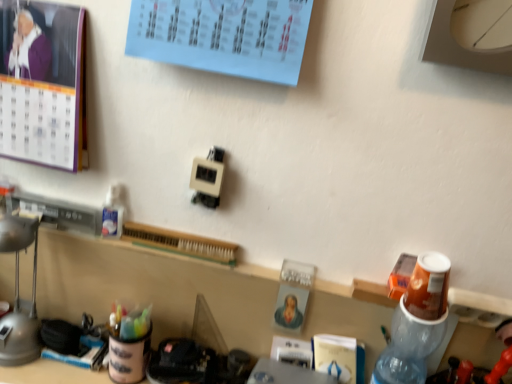
Where is `purple paper calendar at upper left`? Image resolution: width=512 pixels, height=384 pixels. purple paper calendar at upper left is located at coordinates 42,84.

Locate an element on the screen. purple paper calendar at upper left is located at coordinates (42, 84).

Between purple paper calendar at upper left and matte gray lamp at left, which one has less height?

Standing shorter between the two is purple paper calendar at upper left.

In the scene shown: Is purple paper calendar at upper left facing towards matte gray lamp at left?

No, purple paper calendar at upper left is not aimed at matte gray lamp at left.

From a real-world perspective, is purple paper calendar at upper left physically below matte gray lamp at left?

No.

How much distance is there between purple paper calendar at upper left and matte gray lamp at left?

purple paper calendar at upper left is 9.88 inches away from matte gray lamp at left.

From the image's perspective, which object appears higher, matte gray lamp at left or translucent plastic bottle at right?

From the image's view, matte gray lamp at left is above.

Would you say matte gray lamp at left is inside or outside translucent plastic bottle at right?

matte gray lamp at left cannot be found inside translucent plastic bottle at right.

Is matte gray lamp at left facing towards translucent plastic bottle at right?

No, matte gray lamp at left is not facing towards translucent plastic bottle at right.

The height and width of the screenshot is (384, 512). Identify the location of bulletin board positioned vertically above the matte gray lamp at left (from a real-world perspective). (42, 84).

In terms of width, does matte gray lamp at left look wider or thinner when compared to purple paper calendar at upper left?

matte gray lamp at left is wider than purple paper calendar at upper left.

From the image's perspective, is matte gray lamp at left over purple paper calendar at upper left?

No, from the image's perspective, matte gray lamp at left is not on top of purple paper calendar at upper left.

Would you say matte gray lamp at left is a long distance from purple paper calendar at upper left?

No, matte gray lamp at left is not far away from purple paper calendar at upper left.

From the image's perspective, between translucent plastic bottle at right and matte gray lamp at left, who is located below?

translucent plastic bottle at right, from the image's perspective.

Measure the distance from translucent plastic bottle at right to matte gray lamp at left.

translucent plastic bottle at right and matte gray lamp at left are 27.09 inches apart from each other.

Looking at this image, between translucent plastic bottle at right and matte gray lamp at left, which one is positioned in front?

translucent plastic bottle at right.

Is translucent plastic bottle at right located outside matte gray lamp at left?

translucent plastic bottle at right lies outside matte gray lamp at left's area.

Considering the positions of objects translucent plastic bottle at right and purple paper calendar at upper left in the image provided, who is more to the left, translucent plastic bottle at right or purple paper calendar at upper left?

From the viewer's perspective, purple paper calendar at upper left appears more on the left side.

Looking at this image, is translucent plastic bottle at right in front of purple paper calendar at upper left?

Yes.

From the image's perspective, who appears lower, translucent plastic bottle at right or purple paper calendar at upper left?

From the image's view, translucent plastic bottle at right is below.

How different are the orientations of translucent plastic bottle at right and purple paper calendar at upper left in degrees?

translucent plastic bottle at right and purple paper calendar at upper left are facing 2.31 degrees away from each other.

Would you consider purple paper calendar at upper left to be distant from translucent plastic bottle at right?

No, purple paper calendar at upper left is in close proximity to translucent plastic bottle at right.

From the image's perspective, is purple paper calendar at upper left on translucent plastic bottle at right?

Yes, from the image's perspective, purple paper calendar at upper left is over translucent plastic bottle at right.

From their relative heights in the image, would you say purple paper calendar at upper left is taller or shorter than translucent plastic bottle at right?

Considering their sizes, purple paper calendar at upper left has less height than translucent plastic bottle at right.

Based on the photo, is purple paper calendar at upper left positioned behind translucent plastic bottle at right?

That is True.

Find the location of a particular element. Image resolution: width=512 pixels, height=384 pixels. lamp on the left of purple paper calendar at upper left is located at coordinates (19, 296).

The width and height of the screenshot is (512, 384). Identify the location of bottle on the right of matte gray lamp at left. (416, 323).

From the image, which object appears to be nearer to translucent plastic bottle at right, purple paper calendar at upper left or matte gray lamp at left?

Among the two, purple paper calendar at upper left is located nearer to translucent plastic bottle at right.

Looking at the image, which one is located closer to purple paper calendar at upper left, translucent plastic bottle at right or matte gray lamp at left?

Based on the image, matte gray lamp at left appears to be nearer to purple paper calendar at upper left.

Considering their positions, is purple paper calendar at upper left positioned further to matte gray lamp at left than translucent plastic bottle at right?

translucent plastic bottle at right.

Considering their positions, is matte gray lamp at left positioned closer to translucent plastic bottle at right than purple paper calendar at upper left?

purple paper calendar at upper left.

Based on their spatial positions, is matte gray lamp at left or translucent plastic bottle at right further from purple paper calendar at upper left?

Among the two, translucent plastic bottle at right is located further to purple paper calendar at upper left.

Estimate the real-world distances between objects in this image. Which object is further from matte gray lamp at left, translucent plastic bottle at right or purple paper calendar at upper left?

The object further to matte gray lamp at left is translucent plastic bottle at right.

Find the location of a particular element. The height and width of the screenshot is (384, 512). bulletin board between matte gray lamp at left and translucent plastic bottle at right is located at coordinates (42, 84).